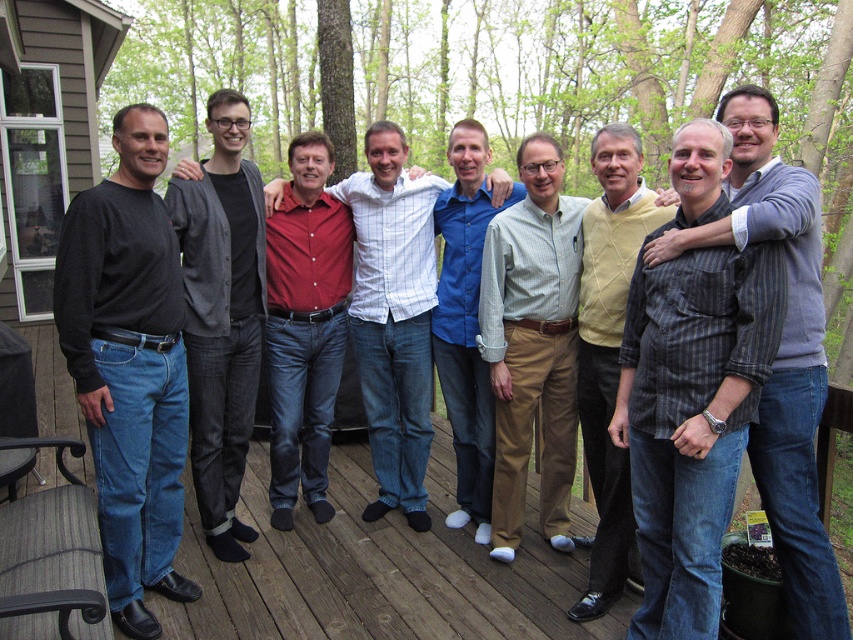
Describe the element at coordinates (532, 342) in the screenshot. The height and width of the screenshot is (640, 853). I see `light green checkered shirt at center` at that location.

How far apart are light green checkered shirt at center and blue cotton shirt at center?

They are 10.41 inches apart.

Locate an element on the screen. The image size is (853, 640). light green checkered shirt at center is located at coordinates (532, 342).

Based on the photo, can you confirm if light green checkered shirt at center is positioned above dark gray cardigan at center?

No, light green checkered shirt at center is not above dark gray cardigan at center.

Which is above, light green checkered shirt at center or dark gray cardigan at center?

dark gray cardigan at center is higher up.

Does point (509, 394) lie behind point (236, 394)?

No, (509, 394) is in front of (236, 394).

Image resolution: width=853 pixels, height=640 pixels. I want to click on light green checkered shirt at center, so click(x=532, y=342).

From the picture: Can you confirm if striped cotton shirt at center is bigger than dark gray cardigan at center?

Yes.

Is striped cotton shirt at center to the left of dark gray cardigan at center from the viewer's perspective?

No, striped cotton shirt at center is not to the left of dark gray cardigan at center.

This screenshot has width=853, height=640. Describe the element at coordinates (780, 353) in the screenshot. I see `striped cotton shirt at center` at that location.

Locate an element on the screen. The width and height of the screenshot is (853, 640). striped cotton shirt at center is located at coordinates (780, 353).